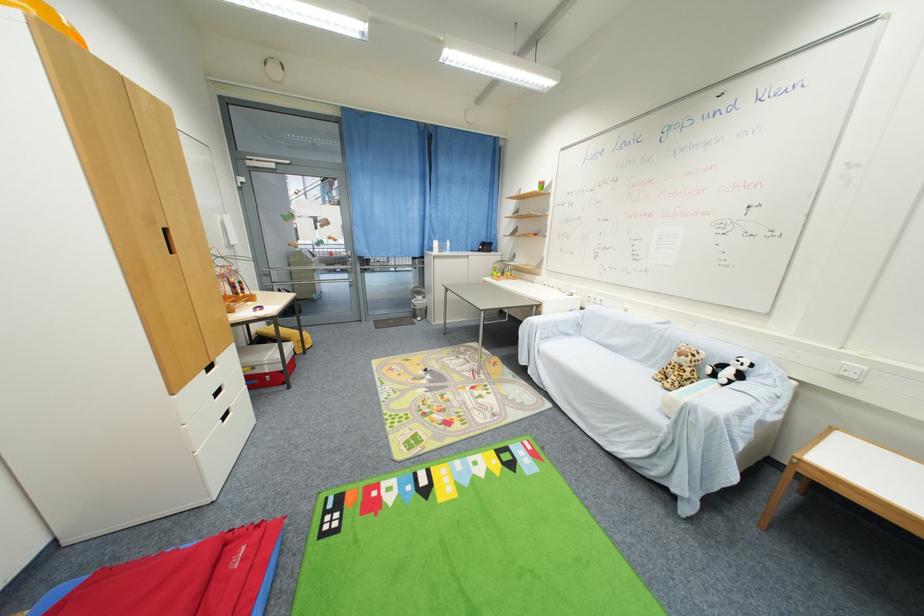
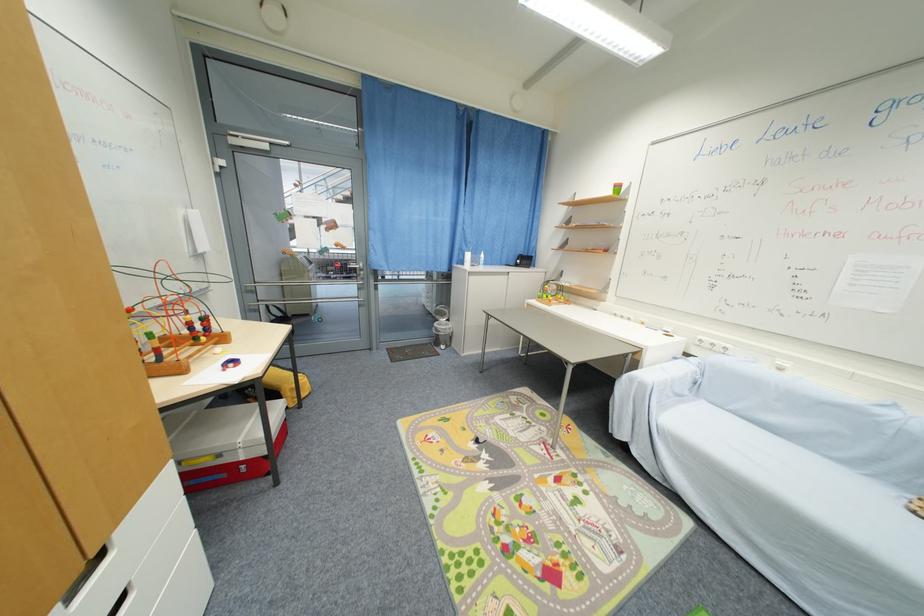
Question: The images are taken continuously from a first-person perspective. In which direction is your viewpoint rotating?

Choices:
 (A) Left
 (B) Right
 (C) Up
 (D) Down

Answer: (B)